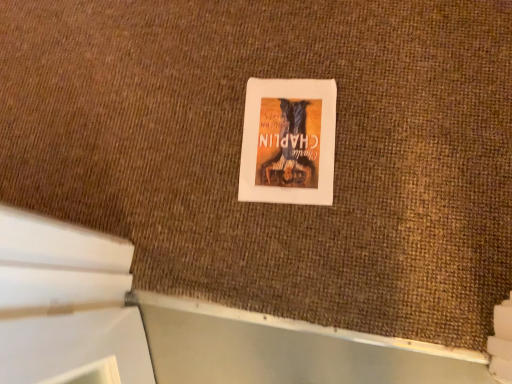
What do you see at coordinates (288, 141) in the screenshot?
I see `white paper at center` at bounding box center [288, 141].

You are a GUI agent. You are given a task and a screenshot of the screen. Output one action in this format:
    pyautogui.click(x=<x>, y=<y>)
    Task: Click on the white paper at center
    
    Given the screenshot: What is the action you would take?
    pyautogui.click(x=288, y=141)

Image resolution: width=512 pixels, height=384 pixels. I want to click on white paper at center, so pos(288,141).